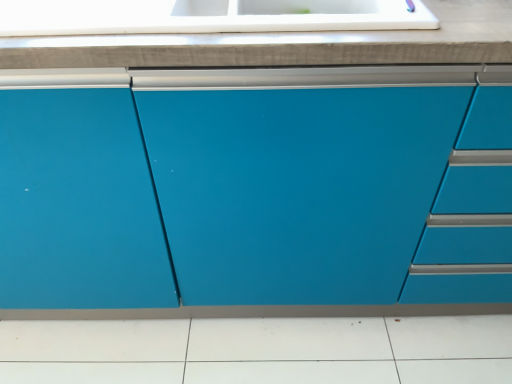
Describe the element at coordinates (301, 182) in the screenshot. This screenshot has width=512, height=384. I see `matte blue cabinet at center` at that location.

This screenshot has width=512, height=384. I want to click on matte blue cabinet at center, so click(x=301, y=182).

Measure the distance between point (x=180, y=135) and camera.

Point (x=180, y=135) and camera are 32.13 inches apart from each other.

Measure the distance between white glossy countertop at upper center and camera.

The distance of white glossy countertop at upper center from camera is 27.28 inches.

The image size is (512, 384). What do you see at coordinates (285, 45) in the screenshot? I see `white glossy countertop at upper center` at bounding box center [285, 45].

Locate an element on the screen. white glossy countertop at upper center is located at coordinates (285, 45).

I want to click on matte blue cabinet at center, so click(x=301, y=182).

Based on the photo, between white glossy countertop at upper center and matte blue cabinet at center, which one appears on the left side from the viewer's perspective?

white glossy countertop at upper center is more to the left.

In the image, is white glossy countertop at upper center positioned in front of or behind matte blue cabinet at center?

white glossy countertop at upper center is positioned farther from the viewer than matte blue cabinet at center.

Considering the positions of points (76, 48) and (466, 157), is point (76, 48) closer to camera compared to point (466, 157)?

Yes, point (76, 48) is closer to viewer.

From the image's perspective, does white glossy countertop at upper center appear higher than matte blue cabinet at center?

Yes, from the image's perspective, white glossy countertop at upper center is above matte blue cabinet at center.

From a real-world perspective, is white glossy countertop at upper center over matte blue cabinet at center?

Yes, from a real-world perspective, white glossy countertop at upper center is above matte blue cabinet at center.

Based on the photo, which of these two, white glossy countertop at upper center or matte blue cabinet at center, is wider?

Wider between the two is matte blue cabinet at center.

Between white glossy countertop at upper center and matte blue cabinet at center, which one has more height?

Standing taller between the two is matte blue cabinet at center.

Which of these two, white glossy countertop at upper center or matte blue cabinet at center, is smaller?

Smaller between the two is white glossy countertop at upper center.

Would you say white glossy countertop at upper center is outside matte blue cabinet at center?

Actually, white glossy countertop at upper center is within matte blue cabinet at center.

Is the surface of white glossy countertop at upper center in direct contact with matte blue cabinet at center?

No.

Is white glossy countertop at upper center facing away from matte blue cabinet at center?

Yes, matte blue cabinet at center is at the back of white glossy countertop at upper center.

The height and width of the screenshot is (384, 512). I want to click on cabinetry that is below the white glossy countertop at upper center (from the image's perspective), so click(x=301, y=182).

Is matte blue cabinet at center at the left side of white glossy countertop at upper center?

In fact, matte blue cabinet at center is to the right of white glossy countertop at upper center.

In the image, is matte blue cabinet at center positioned in front of or behind white glossy countertop at upper center?

Clearly, matte blue cabinet at center is in front of white glossy countertop at upper center.

Does point (431, 129) come in front of point (381, 61)?

No.

From the image's perspective, would you say matte blue cabinet at center is positioned over white glossy countertop at upper center?

No, from the image's perspective, matte blue cabinet at center is not above white glossy countertop at upper center.

From a real-world perspective, is matte blue cabinet at center beneath white glossy countertop at upper center?

Correct, in the physical world, matte blue cabinet at center is lower than white glossy countertop at upper center.

Which object is thinner, matte blue cabinet at center or white glossy countertop at upper center?

Thinner between the two is white glossy countertop at upper center.

Can you confirm if matte blue cabinet at center is shorter than white glossy countertop at upper center?

In fact, matte blue cabinet at center may be taller than white glossy countertop at upper center.

Between matte blue cabinet at center and white glossy countertop at upper center, which one has smaller size?

With smaller size is white glossy countertop at upper center.

Do you think matte blue cabinet at center is within white glossy countertop at upper center, or outside of it?

matte blue cabinet at center is outside white glossy countertop at upper center.

Is matte blue cabinet at center not near white glossy countertop at upper center?

They are positioned close to each other.

Is matte blue cabinet at center looking in the opposite direction of white glossy countertop at upper center?

Yes, matte blue cabinet at center's orientation is away from white glossy countertop at upper center.

Can you tell me how much matte blue cabinet at center and white glossy countertop at upper center differ in facing direction?

matte blue cabinet at center and white glossy countertop at upper center are facing 4.83e-06 degrees away from each other.

At what (x,y) coordinates should I click in order to perform the action: click on cabinetry on the right of the white glossy countertop at upper center. Please return your answer as a coordinate pair (x, y). The width and height of the screenshot is (512, 384). Looking at the image, I should click on (301, 182).

You are a GUI agent. You are given a task and a screenshot of the screen. Output one action in this format:
    pyautogui.click(x=<x>, y=<y>)
    Task: Click on the countertop that is above the matte blue cabinet at center (from a real-world perspective)
    The height and width of the screenshot is (384, 512).
    Given the screenshot: What is the action you would take?
    pyautogui.click(x=285, y=45)

I want to click on countertop behind the matte blue cabinet at center, so click(285, 45).